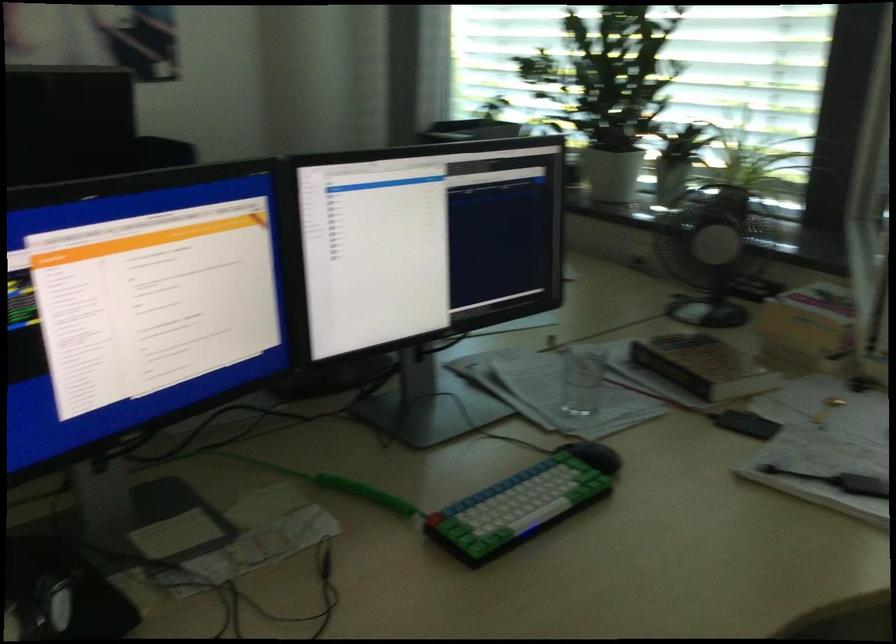
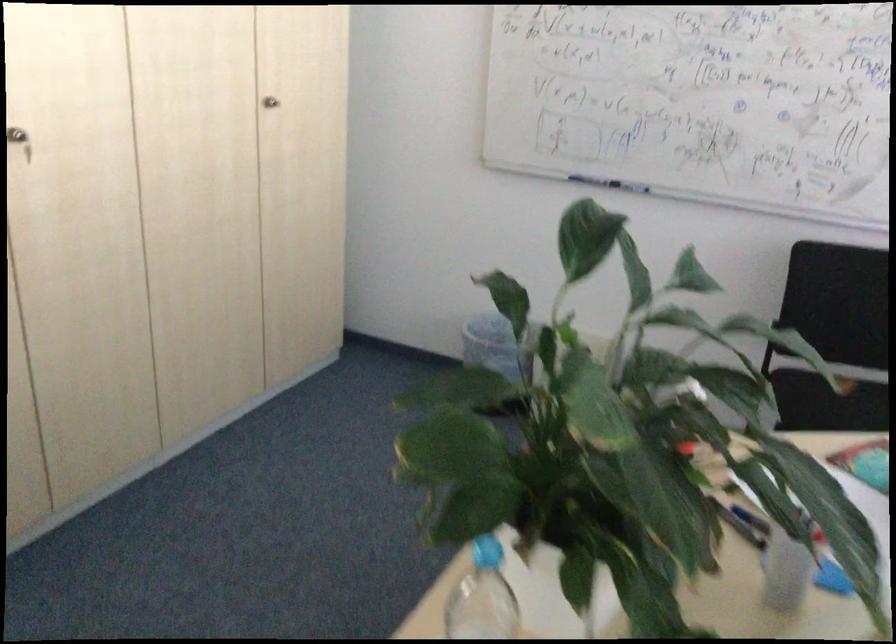
Question: The first image is from the beginning of the video and the second image is from the end. How did the camera likely rotate when shooting the video?

Choices:
 (A) Left
 (B) Right
 (C) Up
 (D) Down

Answer: (A)